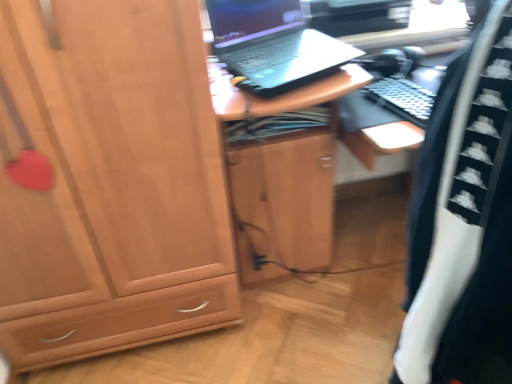
Question: Can you confirm if matte wood cabinet at left is taller than black/white fabric at right?

Choices:
 (A) yes
 (B) no

Answer: (A)

Question: Does matte wood cabinet at left come behind black/white fabric at right?

Choices:
 (A) yes
 (B) no

Answer: (A)

Question: Can you confirm if matte wood cabinet at left is bigger than black/white fabric at right?

Choices:
 (A) no
 (B) yes

Answer: (B)

Question: Is matte wood cabinet at left not inside black/white fabric at right?

Choices:
 (A) yes
 (B) no

Answer: (A)

Question: Is matte wood cabinet at left in contact with black/white fabric at right?

Choices:
 (A) no
 (B) yes

Answer: (A)

Question: Considering the positions of black matte laptop at upper center and matte wood cabinet at left in the image, is black matte laptop at upper center bigger or smaller than matte wood cabinet at left?

Choices:
 (A) big
 (B) small

Answer: (B)

Question: Would you say black matte laptop at upper center is to the left or to the right of matte wood cabinet at left in the picture?

Choices:
 (A) right
 (B) left

Answer: (A)

Question: Is black matte laptop at upper center inside or outside of matte wood cabinet at left?

Choices:
 (A) inside
 (B) outside

Answer: (B)

Question: From a real-world perspective, relative to matte wood cabinet at left, is black matte laptop at upper center vertically above or below?

Choices:
 (A) above
 (B) below

Answer: (A)

Question: From the image's perspective, relative to black matte laptop at upper center, is matte wood cabinet at left above or below?

Choices:
 (A) below
 (B) above

Answer: (A)

Question: Relative to black matte laptop at upper center, is matte wood cabinet at left in front or behind?

Choices:
 (A) behind
 (B) front

Answer: (B)

Question: In terms of height, does matte wood cabinet at left look taller or shorter compared to black matte laptop at upper center?

Choices:
 (A) short
 (B) tall

Answer: (B)

Question: In terms of width, does matte wood cabinet at left look wider or thinner when compared to black matte laptop at upper center?

Choices:
 (A) thin
 (B) wide

Answer: (B)

Question: Is black/white fabric at right wider or thinner than matte wood cabinet at left?

Choices:
 (A) wide
 (B) thin

Answer: (B)

Question: Would you say black/white fabric at right is to the left or to the right of matte wood cabinet at left in the picture?

Choices:
 (A) left
 (B) right

Answer: (B)